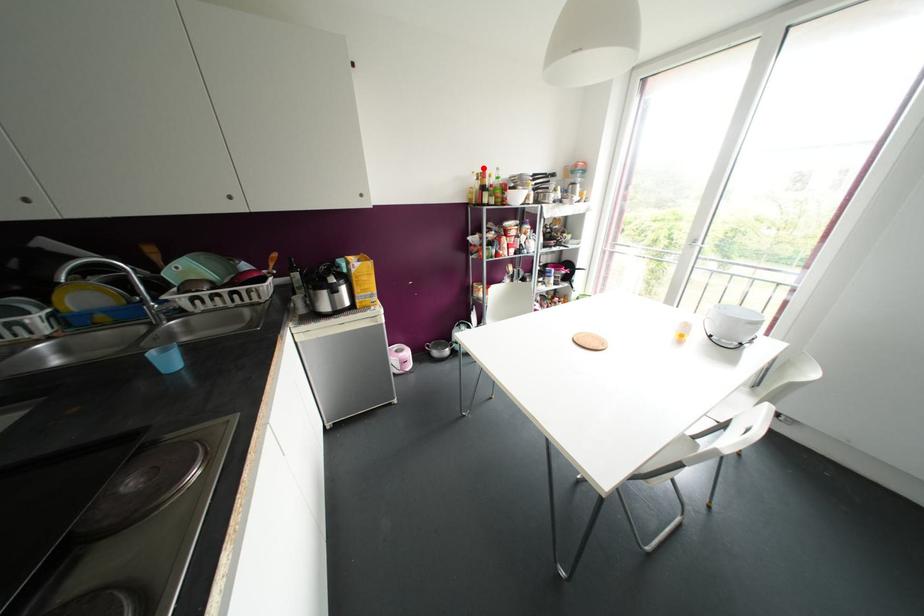
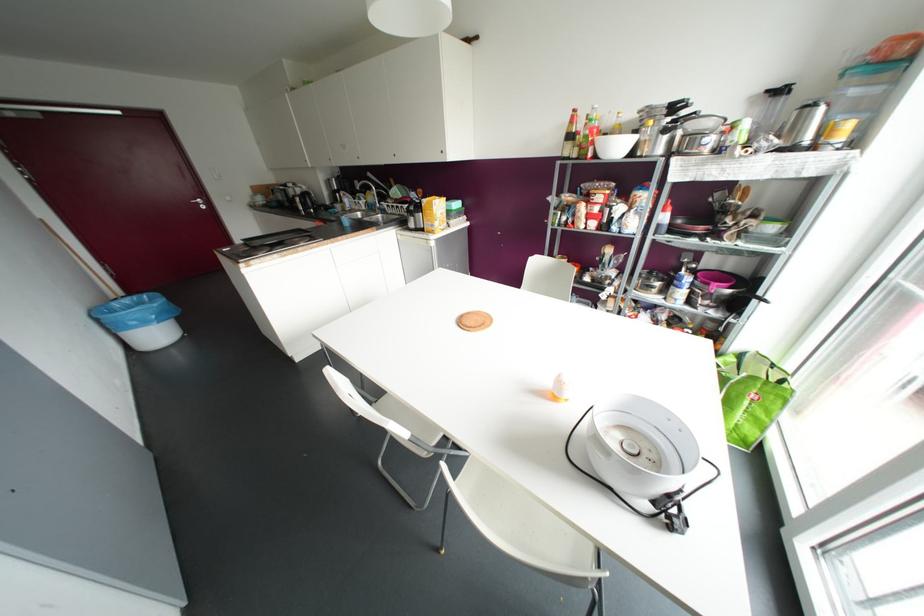
In the second image, find the point that corresponds to the highlighted location in the first image.

(574, 110)